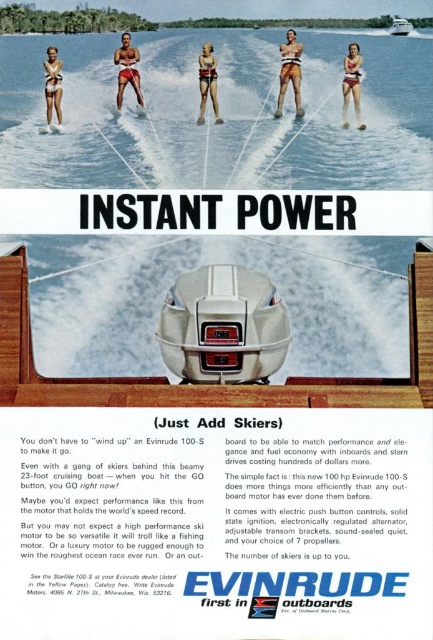
Question: From the image, what is the correct spatial relationship of matte black motorboat at center in relation to white matte boat at upper center?

Choices:
 (A) below
 (B) above

Answer: (A)

Question: Which of the following is the closest to the observer?

Choices:
 (A) matte white bikini at upper left
 (B) white matte boat at upper center
 (C) white water at center
 (D) matte black motorboat at center

Answer: (B)

Question: Among these objects, which one is nearest to the camera?

Choices:
 (A) matte orange life vest at center
 (B) white matte boat at upper center

Answer: (B)

Question: Based on their relative distances, which object is nearer to the matte black skis at center?

Choices:
 (A) matte red shorts at center
 (B) matte white swimsuit at center

Answer: (A)

Question: Is white water at center wider than matte black skis at center?

Choices:
 (A) no
 (B) yes

Answer: (B)

Question: Is matte red shorts at center behind matte orange life vest at center?

Choices:
 (A) yes
 (B) no

Answer: (A)